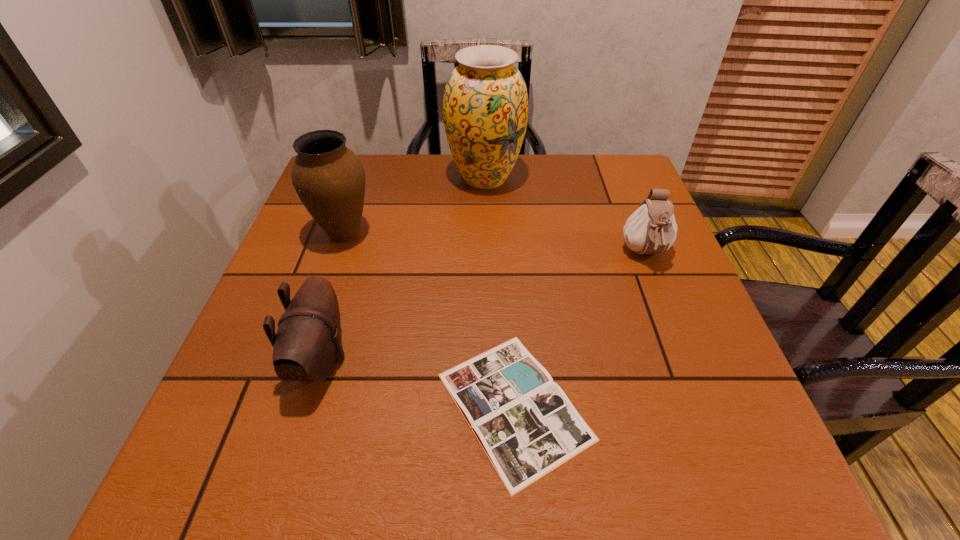
Identify the location of blank area at the right edge. Image resolution: width=960 pixels, height=540 pixels. (679, 325).

You are a GUI agent. You are given a task and a screenshot of the screen. Output one action in this format:
    pyautogui.click(x=<x>, y=<y>)
    Task: Click on the vacant area at the far right corner of the desktop
    Image resolution: width=960 pixels, height=540 pixels.
    Given the screenshot: What is the action you would take?
    pyautogui.click(x=612, y=171)

Find the location of a particular element. vacant region between the right pouch and the book is located at coordinates (580, 330).

Locate an element on the screen. The width and height of the screenshot is (960, 540). free area in between the tallest object and the book is located at coordinates (499, 292).

This screenshot has height=540, width=960. What are the coordinates of `unoccupied position between the farther pouch and the vase` in the screenshot? It's located at (565, 216).

Find the location of `empty location between the vase and the urn`. empty location between the vase and the urn is located at coordinates (415, 206).

The width and height of the screenshot is (960, 540). Identify the location of unoccupied area between the farthest object and the second tallest object. (415, 206).

Find the location of a particular element. The height and width of the screenshot is (540, 960). empty space that is in between the book and the nearer pouch is located at coordinates (418, 383).

Where is `vacant region between the second tallest object and the farther pouch`? The image size is (960, 540). vacant region between the second tallest object and the farther pouch is located at coordinates (494, 244).

Image resolution: width=960 pixels, height=540 pixels. What are the coordinates of `free space between the shortest object and the fourth shortest object` in the screenshot? It's located at click(x=429, y=320).